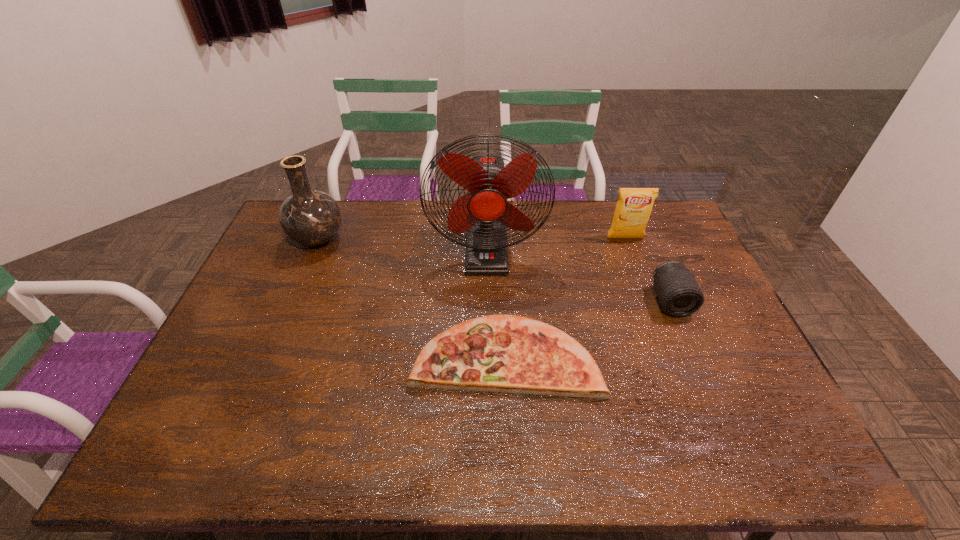
Point out which object is positioned as the third nearest to the vase. Please provide its 2D coordinates. Your answer should be formatted as a tuple, i.e. [(x, y)], where the tuple contains the x and y coordinates of a point satisfying the conditions above.

[(634, 206)]

Locate an element on the screen. This screenshot has height=540, width=960. free region that satisfies the following two spatial constraints: 1. on the front-facing side of the fan; 2. on the right side of the pizza is located at coordinates (488, 355).